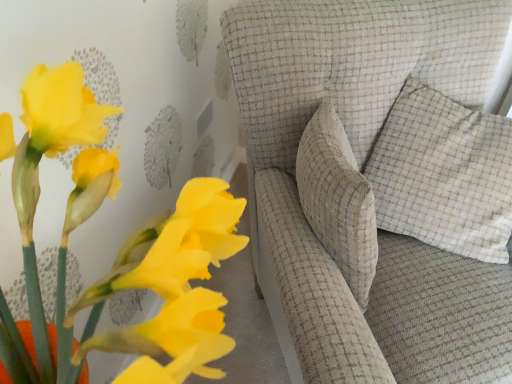
Question: Is beige checkered pillow at upper right directly adjacent to textured beige sofa at center?

Choices:
 (A) yes
 (B) no

Answer: (B)

Question: Can you confirm if beige checkered pillow at upper right is smaller than textured beige sofa at center?

Choices:
 (A) yes
 (B) no

Answer: (A)

Question: Is beige checkered pillow at upper right aimed at textured beige sofa at center?

Choices:
 (A) yes
 (B) no

Answer: (A)

Question: From a real-world perspective, is beige checkered pillow at upper right beneath textured beige sofa at center?

Choices:
 (A) yes
 (B) no

Answer: (B)

Question: From the image's perspective, is beige checkered pillow at upper right located above textured beige sofa at center?

Choices:
 (A) no
 (B) yes

Answer: (B)

Question: Are beige checkered pillow at upper right and textured beige sofa at center far apart?

Choices:
 (A) no
 (B) yes

Answer: (A)

Question: Can you confirm if beige checkered pillow at upper right is taller than matte yellow flowers at lower left?

Choices:
 (A) yes
 (B) no

Answer: (B)

Question: Does beige checkered pillow at upper right have a smaller size compared to matte yellow flowers at lower left?

Choices:
 (A) yes
 (B) no

Answer: (A)

Question: Is beige checkered pillow at upper right thinner than matte yellow flowers at lower left?

Choices:
 (A) no
 (B) yes

Answer: (B)

Question: Is beige checkered pillow at upper right looking in the opposite direction of matte yellow flowers at lower left?

Choices:
 (A) no
 (B) yes

Answer: (A)

Question: Can you confirm if beige checkered pillow at upper right is bigger than matte yellow flowers at lower left?

Choices:
 (A) yes
 (B) no

Answer: (B)

Question: Is beige checkered pillow at upper right far away from matte yellow flowers at lower left?

Choices:
 (A) no
 (B) yes

Answer: (A)

Question: Is textured beige sofa at center beside beige checkered pillow at upper right?

Choices:
 (A) yes
 (B) no

Answer: (B)